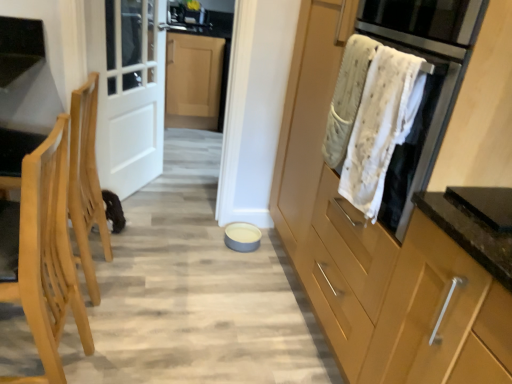
Question: Is matte white sink at upper center wider than clear glass door at upper left?

Choices:
 (A) no
 (B) yes

Answer: (B)

Question: From the image's perspective, is matte white sink at upper center beneath clear glass door at upper left?

Choices:
 (A) yes
 (B) no

Answer: (B)

Question: Can you confirm if matte white sink at upper center is bigger than clear glass door at upper left?

Choices:
 (A) yes
 (B) no

Answer: (B)

Question: From a real-world perspective, is matte white sink at upper center over clear glass door at upper left?

Choices:
 (A) no
 (B) yes

Answer: (B)

Question: Is matte white sink at upper center positioned before clear glass door at upper left?

Choices:
 (A) yes
 (B) no

Answer: (B)

Question: Is matte white sink at upper center not inside clear glass door at upper left?

Choices:
 (A) yes
 (B) no

Answer: (A)

Question: Does white textured towel at upper right have a lesser width compared to matte white sink at upper center?

Choices:
 (A) no
 (B) yes

Answer: (B)

Question: Considering the relative sizes of white textured towel at upper right and matte white sink at upper center in the image provided, is white textured towel at upper right wider than matte white sink at upper center?

Choices:
 (A) no
 (B) yes

Answer: (A)

Question: Considering the relative sizes of white textured towel at upper right and matte white sink at upper center in the image provided, is white textured towel at upper right smaller than matte white sink at upper center?

Choices:
 (A) yes
 (B) no

Answer: (A)

Question: Is white textured towel at upper right looking in the opposite direction of matte white sink at upper center?

Choices:
 (A) no
 (B) yes

Answer: (A)

Question: Is white textured towel at upper right to the left of matte white sink at upper center from the viewer's perspective?

Choices:
 (A) yes
 (B) no

Answer: (B)

Question: From the image's perspective, is white textured towel at upper right below matte white sink at upper center?

Choices:
 (A) yes
 (B) no

Answer: (A)

Question: From a real-world perspective, is white textured towel at upper right below clear glass door at upper left?

Choices:
 (A) yes
 (B) no

Answer: (B)